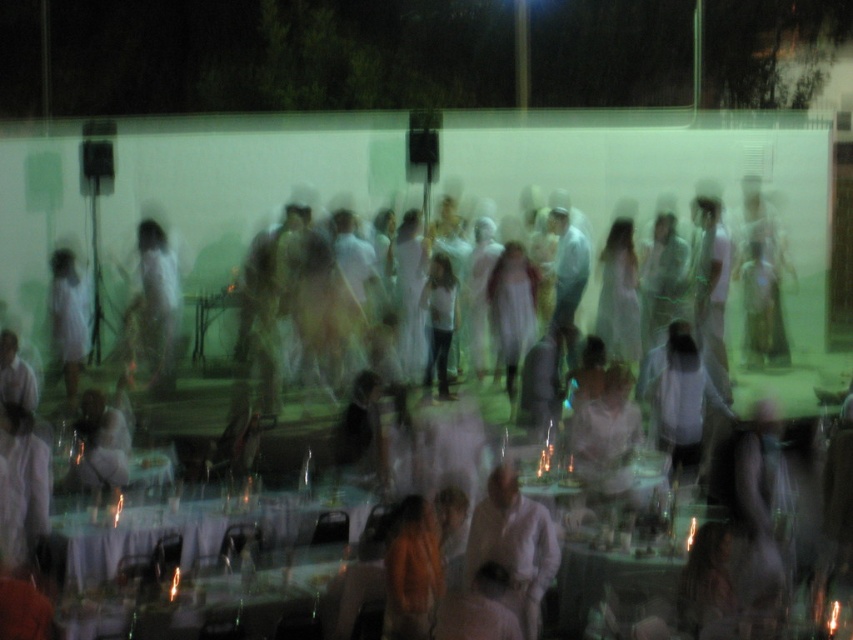
Question: Is translucent glass table at lower center to the right of translucent glass table at center from the viewer's perspective?

Choices:
 (A) no
 (B) yes

Answer: (A)

Question: Is translucent glass table at lower center to the right of translucent glass table at center from the viewer's perspective?

Choices:
 (A) no
 (B) yes

Answer: (A)

Question: Which of the following is the farthest from the observer?

Choices:
 (A) white matte shirt at center
 (B) white sheer dress at center
 (C) white sheer fabric at center
 (D) translucent glass table at center

Answer: (B)

Question: In this image, where is white sheer fabric at center located relative to translucent glass table at center?

Choices:
 (A) below
 (B) above

Answer: (B)

Question: Among these objects, which one is farthest from the camera?

Choices:
 (A) translucent glass table at center
 (B) translucent glass table at lower center
 (C) white matte shirt at center

Answer: (A)

Question: Which of these objects is positioned closest to the white matte shirt at center?

Choices:
 (A) translucent glass table at lower center
 (B) white lace tablecloth at lower left
 (C) translucent glass table at center
 (D) white sheer fabric at center

Answer: (C)